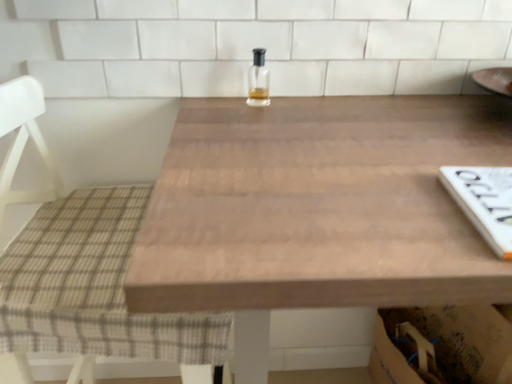
Locate an element on the screen. The height and width of the screenshot is (384, 512). free point in front of clear glass bottle at center is located at coordinates (274, 132).